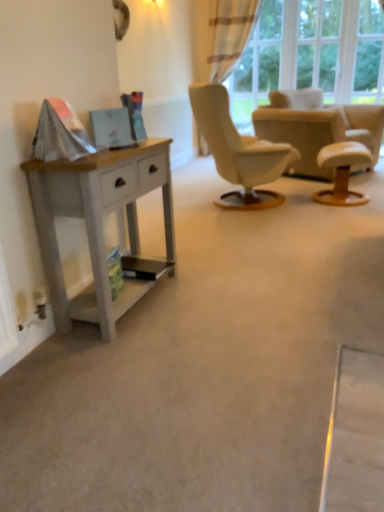
Question: In terms of size, does white wood desk at left appear bigger or smaller than plaid fabric curtain at upper right?

Choices:
 (A) small
 (B) big

Answer: (A)

Question: From a real-world perspective, is white wood desk at left positioned above or below plaid fabric curtain at upper right?

Choices:
 (A) above
 (B) below

Answer: (B)

Question: Estimate the real-world distances between objects in this image. Which object is closer to the beige fabric armchair at center?

Choices:
 (A) plaid fabric curtain at upper right
 (B) white leather stool at right
 (C) white wood desk at left
 (D) transparent glass door at upper right

Answer: (B)

Question: Estimate the real-world distances between objects in this image. Which object is closer to the plaid fabric curtain at upper right?

Choices:
 (A) transparent glass door at upper right
 (B) beige fabric armchair at center
 (C) white wood desk at left
 (D) white leather stool at right

Answer: (A)